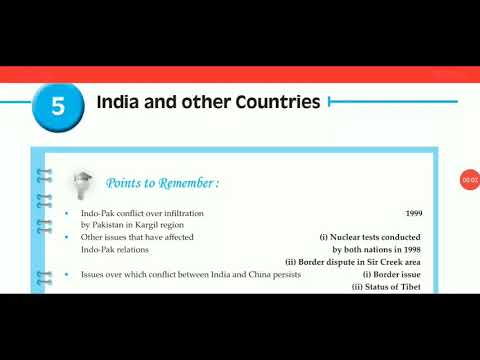
You are a GUI agent. You are given a task and a screenshot of the screen. Output one action in this format:
    pyautogui.click(x=<x>, y=<y>)
    Task: Click on the light
    Image resolution: width=480 pixels, height=360 pixels.
    Given the screenshot: What is the action you would take?
    pyautogui.click(x=86, y=186)